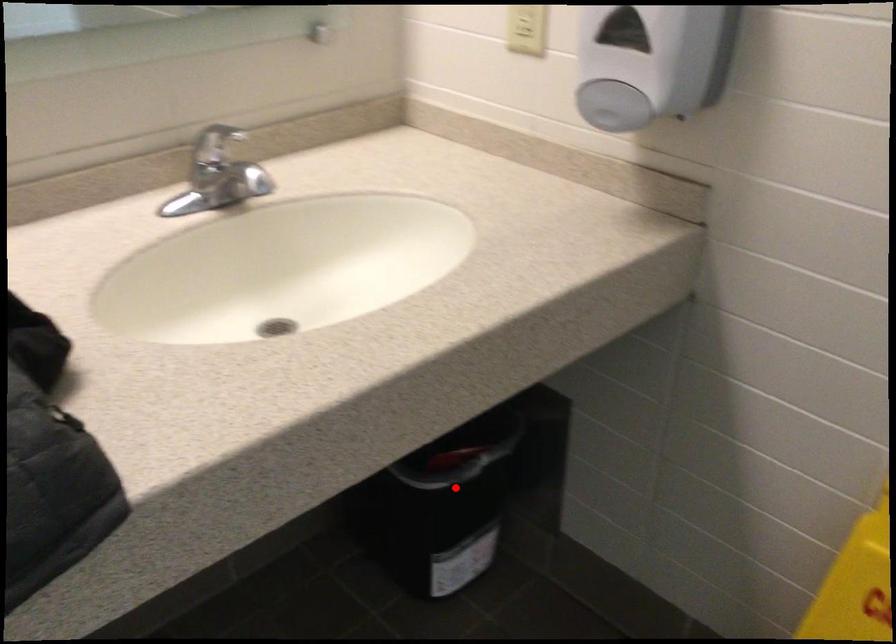
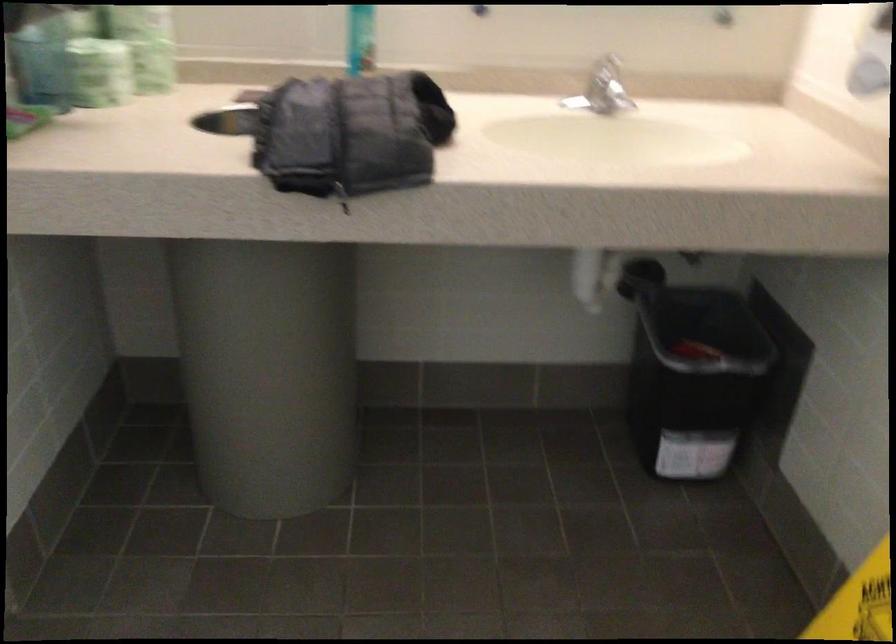
In the second image, find the point that corresponds to the highlighted location in the first image.

(691, 373)